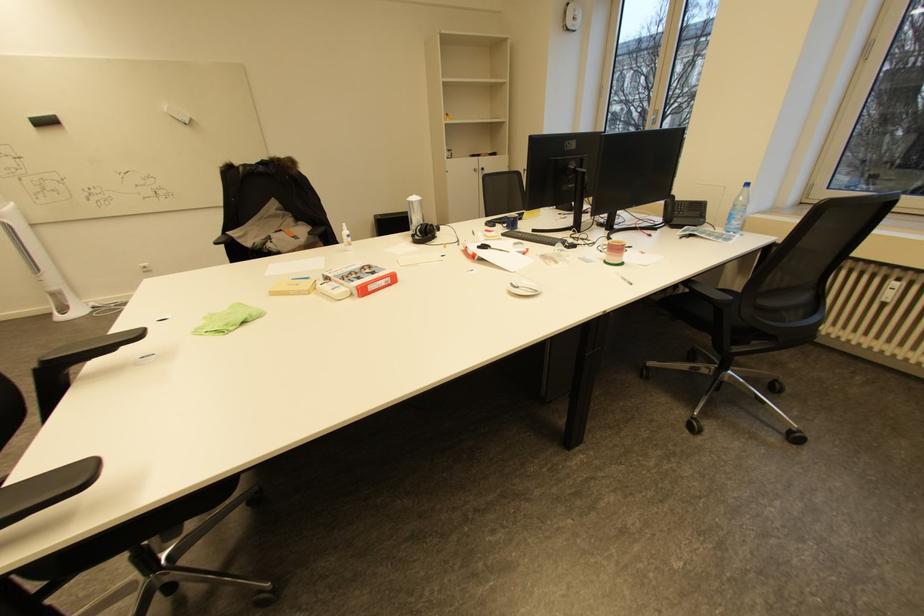
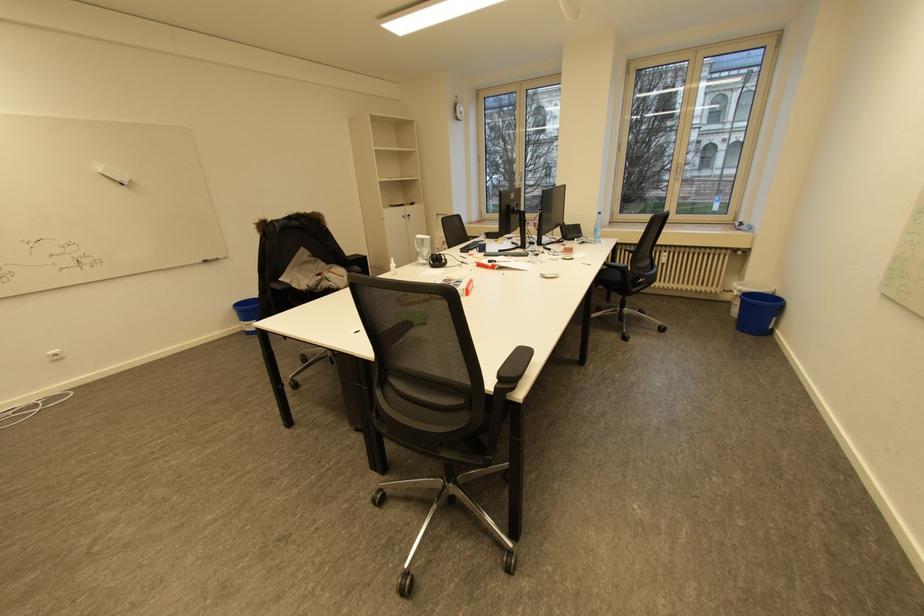
In the second image, find the point that corresponds to the point at 736,215 in the first image.

(601, 230)